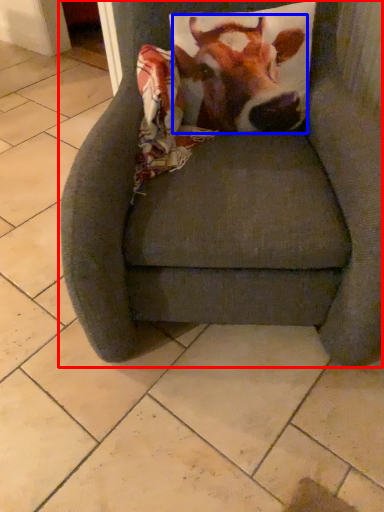
Question: Which point is closer to the camera, chair (highlighted by a red box) or cattle (highlighted by a blue box)?

Choices:
 (A) chair
 (B) cattle

Answer: (A)